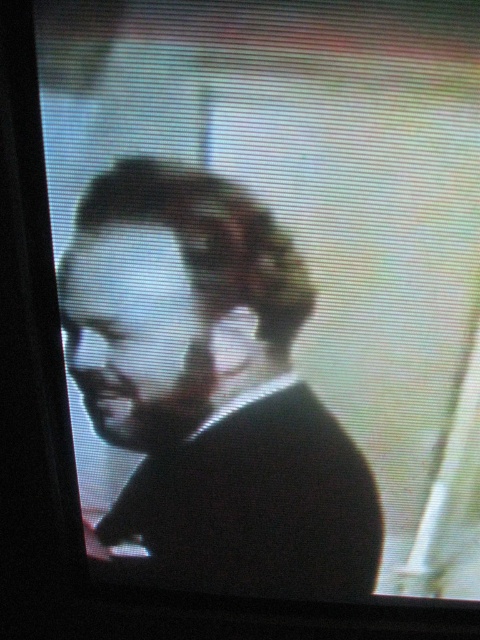
Can you confirm if black matte suit at center is bigger than matte black face at center?

Indeed, black matte suit at center has a larger size compared to matte black face at center.

Is black matte suit at center positioned in front of matte black face at center?

Yes.

This screenshot has height=640, width=480. Identify the location of black matte suit at center. (211, 388).